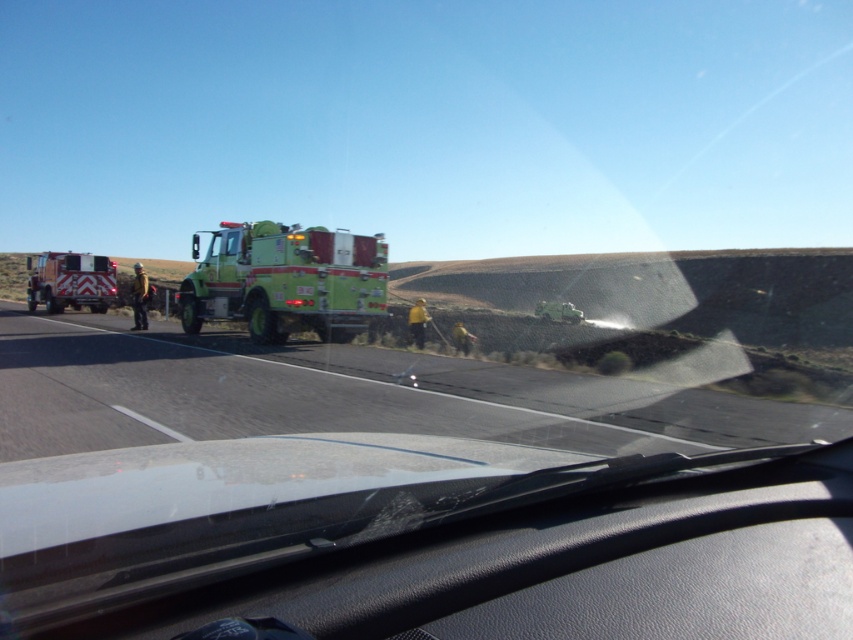
Can you confirm if black asphalt highway at center is positioned to the left of green matte fire truck at center?

Incorrect, black asphalt highway at center is not on the left side of green matte fire truck at center.

Does black asphalt highway at center appear on the right side of green matte fire truck at center?

Yes, black asphalt highway at center is to the right of green matte fire truck at center.

Is point (373, 408) positioned in front of point (296, 260)?

That is True.

Where is `black asphalt highway at center`? black asphalt highway at center is located at coordinates (343, 396).

Is green matte fire truck at center to the left of brushed metal fire truck at left from the viewer's perspective?

No, green matte fire truck at center is not to the left of brushed metal fire truck at left.

Does green matte fire truck at center appear over brushed metal fire truck at left?

No, green matte fire truck at center is not above brushed metal fire truck at left.

Is point (300, 307) positioned after point (107, 305)?

No.

Locate an element on the screen. The width and height of the screenshot is (853, 640). green matte fire truck at center is located at coordinates (285, 280).

Is point (842, 412) less distant than point (57, 282)?

That is True.

Does black asphalt highway at center appear on the left side of brushed metal fire truck at left?

Incorrect, black asphalt highway at center is not on the left side of brushed metal fire truck at left.

This screenshot has width=853, height=640. What are the coordinates of `black asphalt highway at center` in the screenshot? It's located at (343, 396).

You are a GUI agent. You are given a task and a screenshot of the screen. Output one action in this format:
    pyautogui.click(x=<x>, y=<y>)
    Task: Click on the black asphalt highway at center
    
    Given the screenshot: What is the action you would take?
    pyautogui.click(x=343, y=396)